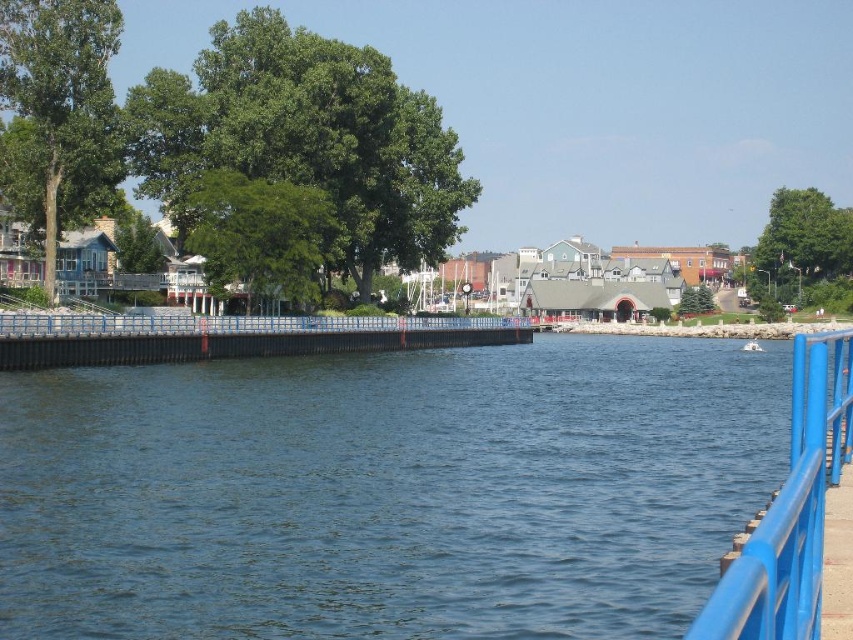
Looking at this image, is blue metallic river at center to the right of blue metallic railing at right from the viewer's perspective?

In fact, blue metallic river at center is to the left of blue metallic railing at right.

Can you confirm if blue metallic river at center is bigger than blue metallic railing at right?

Correct, blue metallic river at center is larger in size than blue metallic railing at right.

Is point (462, 369) farther from camera compared to point (809, 468)?

Yes, it is.

At what (x,y) coordinates should I click in order to perform the action: click on blue metallic river at center. Please return your answer as a coordinate pair (x, y). Looking at the image, I should click on (386, 492).

Consider the image. Is blue metallic railing at right behind white plastic boat at center?

No.

Can you confirm if blue metallic railing at right is wider than white plastic boat at center?

Indeed, blue metallic railing at right has a greater width compared to white plastic boat at center.

Locate an element on the screen. blue metallic railing at right is located at coordinates (790, 509).

The height and width of the screenshot is (640, 853). Find the location of `blue metallic railing at right`. blue metallic railing at right is located at coordinates tap(790, 509).

Is blue metallic river at center to the right of white plastic boat at center from the viewer's perspective?

In fact, blue metallic river at center is to the left of white plastic boat at center.

At what (x,y) coordinates should I click in order to perform the action: click on blue metallic river at center. Please return your answer as a coordinate pair (x, y). The height and width of the screenshot is (640, 853). Looking at the image, I should click on (386, 492).